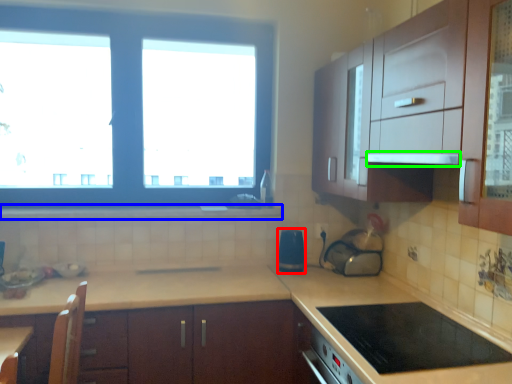
Question: Considering the real-world distances, which object is farthest from appliance (highlighted by a red box)? window sill (highlighted by a blue box) or exhaust hood (highlighted by a green box)?

Choices:
 (A) window sill
 (B) exhaust hood

Answer: (B)